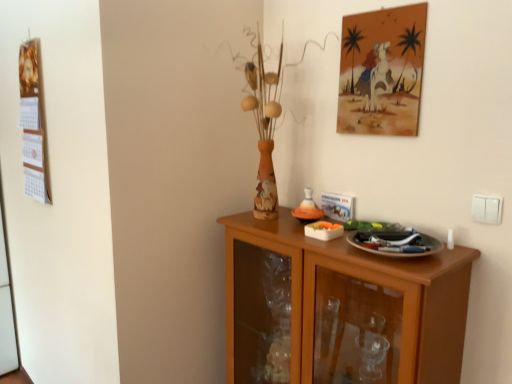
Question: From a real-world perspective, is wooden calendar at left physically located above or below white plastic switch at right?

Choices:
 (A) above
 (B) below

Answer: (A)

Question: Which is correct: wooden calendar at left is inside white plastic switch at right, or outside of it?

Choices:
 (A) outside
 (B) inside

Answer: (A)

Question: Which object is the closest to the watercolor painting at upper right?

Choices:
 (A) wooden calendar at left
 (B) wooden cabinet at lower right
 (C) white plastic switch at right

Answer: (C)

Question: Considering the real-world distances, which object is farthest from the wooden calendar at left?

Choices:
 (A) watercolor painting at upper right
 (B) white plastic switch at right
 (C) wooden cabinet at lower right

Answer: (B)